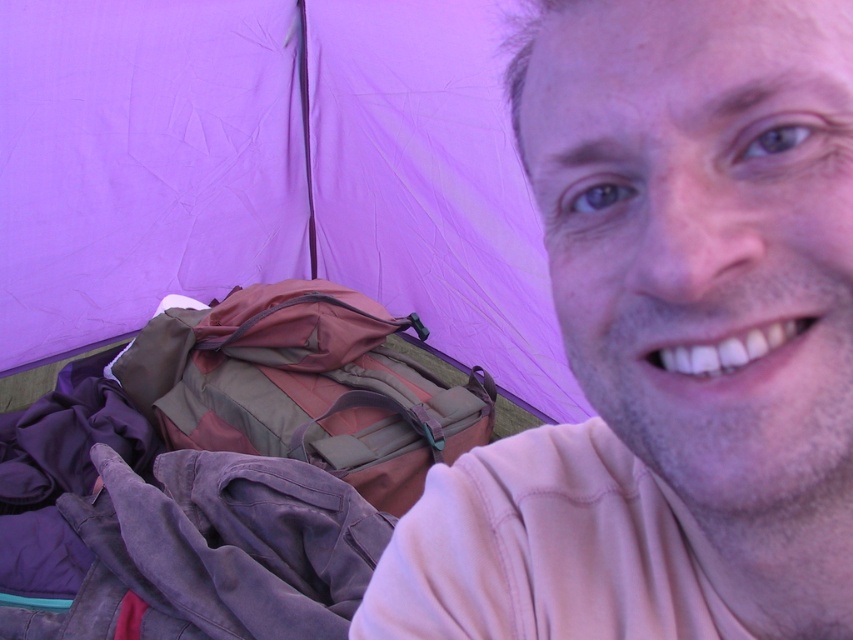
Question: Which of the following is the farthest from the observer?

Choices:
 (A) purple fabric tent at center
 (B) pink fabric at upper right
 (C) multicolored fabric backpack at center

Answer: (A)

Question: Is pink fabric at upper right smaller than purple fabric tent at center?

Choices:
 (A) no
 (B) yes

Answer: (B)

Question: Does pink fabric at upper right appear on the right side of purple fabric tent at center?

Choices:
 (A) no
 (B) yes

Answer: (B)

Question: Which of these objects is positioned farthest from the purple fabric tent at center?

Choices:
 (A) pink fabric at upper right
 (B) multicolored fabric backpack at center

Answer: (A)

Question: Among these points, which one is farthest from the camera?

Choices:
 (A) (630, 106)
 (B) (71, 243)
 (C) (210, 422)

Answer: (B)

Question: Where is purple fabric tent at center located in relation to multicolored fabric backpack at center in the image?

Choices:
 (A) right
 (B) left

Answer: (A)